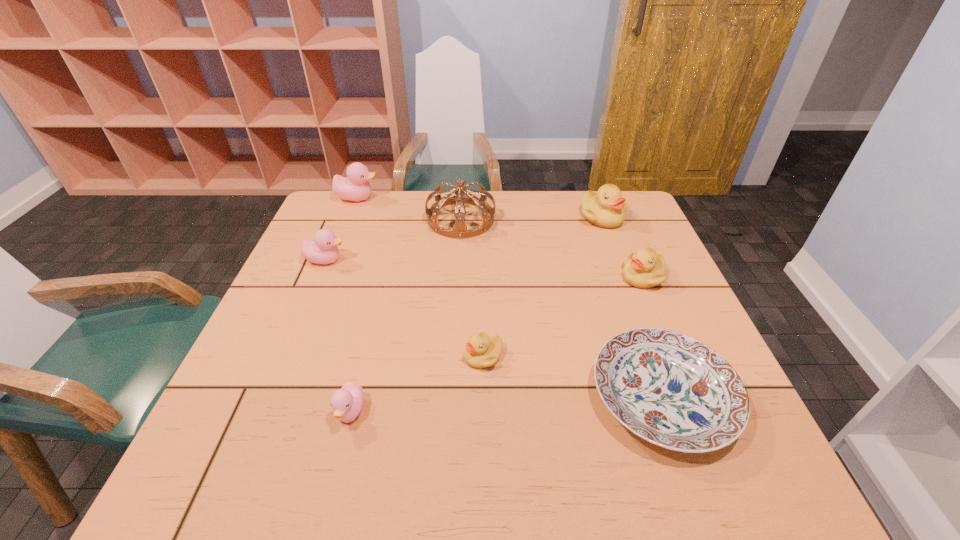
The height and width of the screenshot is (540, 960). Identify the location of vacant space at the right edge of the desktop. (664, 298).

At what (x,y) coordinates should I click in order to perform the action: click on free space at the near left corner of the desktop. Please return your answer as a coordinate pair (x, y). The height and width of the screenshot is (540, 960). Looking at the image, I should click on [276, 450].

Where is `unoccupied area between the fourth duckling from left to right and the biggest pink duckling`? This screenshot has width=960, height=540. unoccupied area between the fourth duckling from left to right and the biggest pink duckling is located at coordinates (420, 277).

Identify the location of unoccupied area between the farthest yellow duckling and the second smallest yellow duckling. (622, 247).

Identify the location of vacant region between the farthest yellow duckling and the leftmost yellow duckling. This screenshot has height=540, width=960. (542, 287).

Locate an element on the screen. vacant area that lies between the tiara and the nearest duckling is located at coordinates (406, 316).

This screenshot has width=960, height=540. Identify the location of vacant region between the nearest duckling and the second farthest pink duckling. (338, 336).

Identify the location of empty location between the farthest yellow duckling and the second farthest yellow duckling. This screenshot has height=540, width=960. (622, 247).

Find the location of `vacant space in between the second biggest yellow duckling and the biggest yellow duckling`. vacant space in between the second biggest yellow duckling and the biggest yellow duckling is located at coordinates (622, 247).

In order to click on vacant space that is in between the shortest object and the brown tiara in this screenshot , I will do pos(562,308).